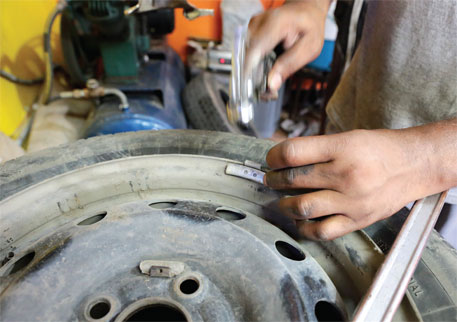
This screenshot has width=457, height=322. I want to click on yellow wall, so click(x=26, y=26).